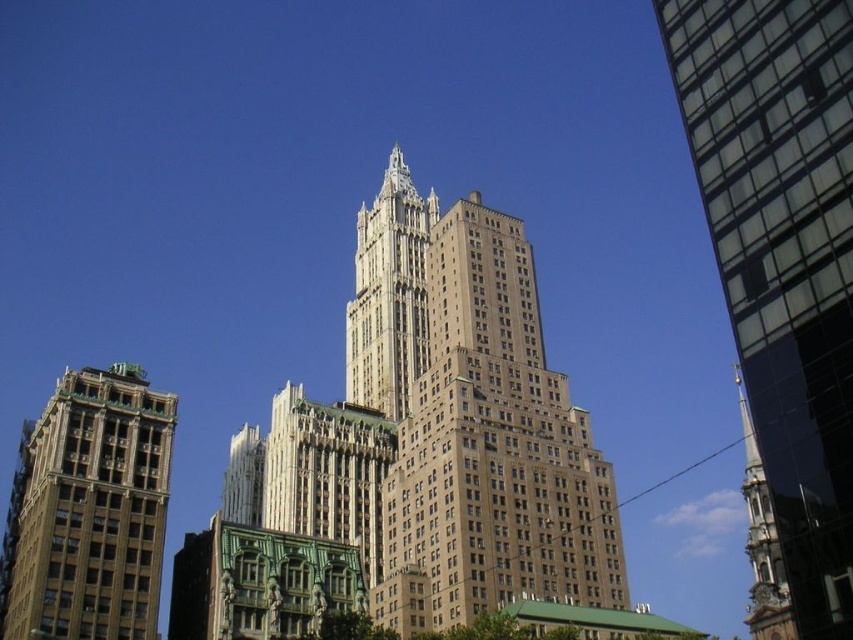
Locate an element on the screen. The height and width of the screenshot is (640, 853). glassy reflective skyscraper at right is located at coordinates (782, 256).

Does glassy reflective skyscraper at right appear on the left side of gold stone tower at center?

Incorrect, glassy reflective skyscraper at right is not on the left side of gold stone tower at center.

Who is more distant from viewer, [692,99] or [390,164]?

The point [390,164] is more distant.

You are a GUI agent. You are given a task and a screenshot of the screen. Output one action in this format:
    pyautogui.click(x=<x>, y=<y>)
    Task: Click on the glassy reflective skyscraper at right
    The width and height of the screenshot is (853, 640).
    Given the screenshot: What is the action you would take?
    pyautogui.click(x=782, y=256)

Who is more forward, (791, 12) or (149, 588)?

Positioned in front is point (791, 12).

Between point (698, 16) and point (97, 468), which one is positioned behind?

Point (97, 468)

I want to click on glassy reflective skyscraper at right, so click(782, 256).

The height and width of the screenshot is (640, 853). Describe the element at coordinates (90, 509) in the screenshot. I see `brown stone tower at left` at that location.

Is brown stone tower at left thinner than gold stone tower at center?

In fact, brown stone tower at left might be wider than gold stone tower at center.

Describe the element at coordinates (90, 509) in the screenshot. The image size is (853, 640). I see `brown stone tower at left` at that location.

Identify the location of brown stone tower at left. (90, 509).